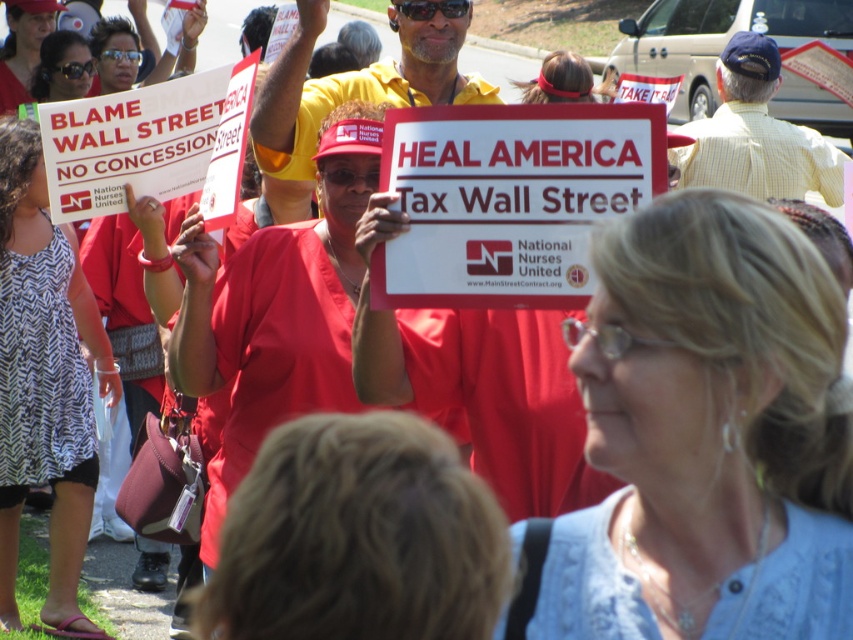
Between point (306, 266) and point (538, 80), which one is positioned behind?

Positioned behind is point (538, 80).

Is matte red scrubs at center shorter than matte red headband at center?

No.

Which is in front, point (318, 403) or point (592, 99)?

Positioned in front is point (318, 403).

This screenshot has height=640, width=853. What are the coordinates of `matte red scrubs at center` in the screenshot? It's located at (276, 314).

Which of these two, matte red scrubs at center or yellow checkered shirt at upper right, stands taller?

matte red scrubs at center

Is matte red scrubs at center to the left of yellow checkered shirt at upper right from the viewer's perspective?

Yes, matte red scrubs at center is to the left of yellow checkered shirt at upper right.

What do you see at coordinates (276, 314) in the screenshot? I see `matte red scrubs at center` at bounding box center [276, 314].

The width and height of the screenshot is (853, 640). I want to click on matte red scrubs at center, so click(276, 314).

Between blue lace shirt at center and matte red shirt at center, which one has more height?

With more height is matte red shirt at center.

Is point (631, 544) closer to camera compared to point (25, 40)?

Yes, it is.

At what (x,y) coordinates should I click in order to perform the action: click on blue lace shirt at center. Please return your answer as a coordinate pair (x, y). Looking at the image, I should click on (703, 436).